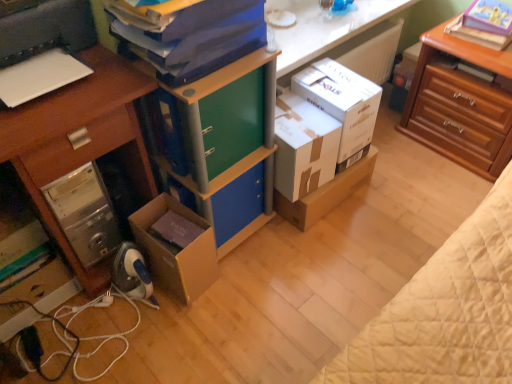
You are a GUI agent. You are given a task and a screenshot of the screen. Output one action in this format:
    pyautogui.click(x=<x>, y=<y>)
    Task: Click on the empty space that is ontop of white cardboard box at center, positioned as the first box in right-to-left order
    
    Given the screenshot: What is the action you would take?
    pyautogui.click(x=340, y=79)